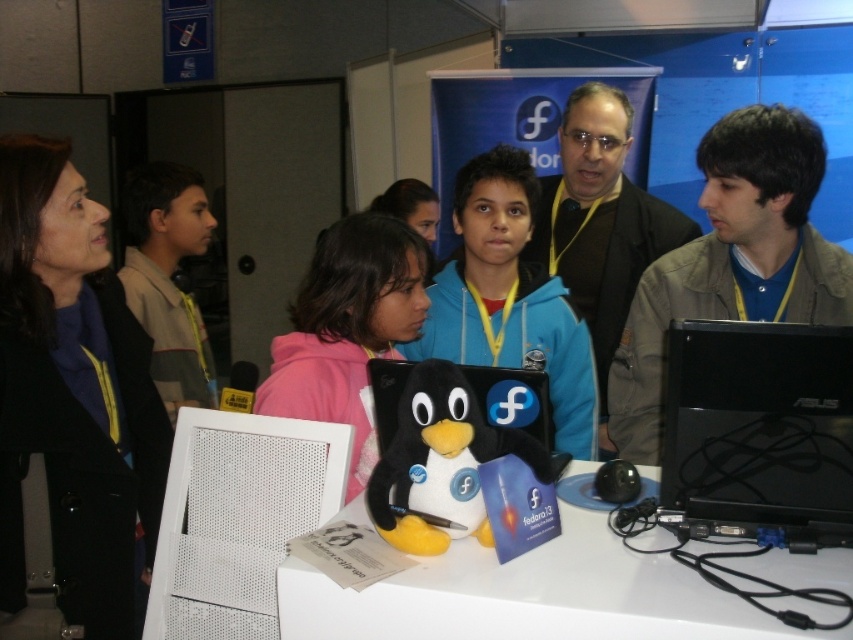
Question: Based on their relative distances, which object is nearer to the black plush penguin at center?

Choices:
 (A) matte pink hoodie at center
 (B) pink fleece jacket at center
 (C) brown uniform shirt at left

Answer: (B)

Question: Is matte black jacket at left further to the viewer compared to black plastic laptop at lower right?

Choices:
 (A) no
 (B) yes

Answer: (B)

Question: Observing the image, what is the correct spatial positioning of black plastic laptop at lower right in reference to light brown jacket at center?

Choices:
 (A) left
 (B) right

Answer: (A)

Question: Is black plush penguin at center in front of matte pink hoodie at center?

Choices:
 (A) yes
 (B) no

Answer: (A)

Question: Considering the real-world distances, which object is closest to the matte black jacket at center?

Choices:
 (A) black plush penguin at center
 (B) blue fleece jacket at center
 (C) matte pink hoodie at center
 (D) black plastic laptop at lower right

Answer: (B)

Question: Which object appears farthest from the camera in this image?

Choices:
 (A) pink fleece jacket at center
 (B) light brown jacket at center
 (C) matte black jacket at left
 (D) matte black jacket at center

Answer: (D)